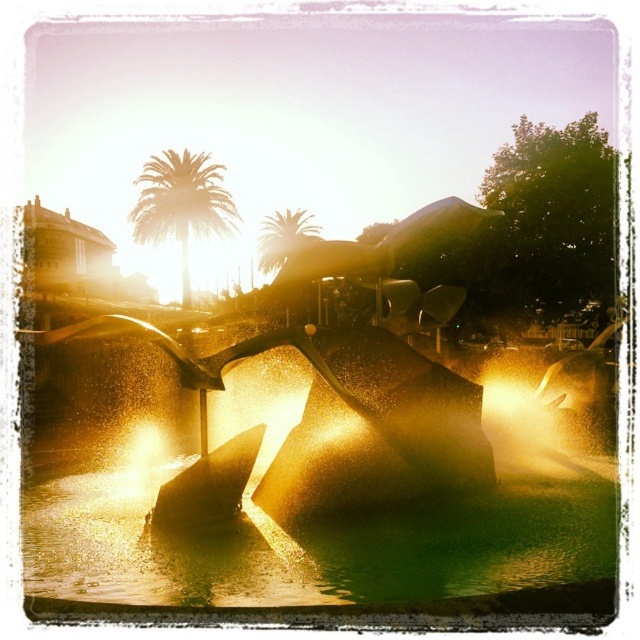
Identify the location of green leafy palm tree at upper left. (180, 204).

Between green leafy palm tree at upper left and green leafy palm tree at upper center, which one is positioned higher?

green leafy palm tree at upper left

Where is `green leafy palm tree at upper left`? green leafy palm tree at upper left is located at coordinates (180, 204).